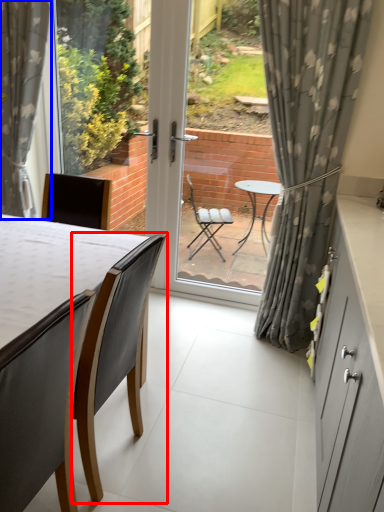
Question: Which point is further to the camera, chair (highlighted by a red box) or curtain (highlighted by a blue box)?

Choices:
 (A) chair
 (B) curtain

Answer: (B)